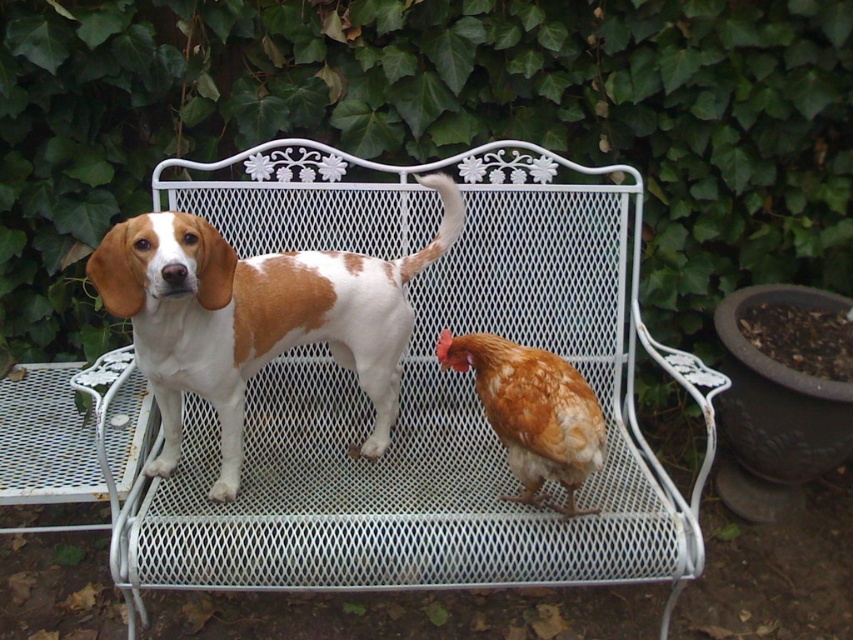
Question: Among these points, which one is farthest from the camera?

Choices:
 (A) (381, 442)
 (B) (556, 452)
 (C) (177, 184)

Answer: (C)

Question: Which point is closer to the camera?

Choices:
 (A) brown and white fur dog at center
 (B) white metal bench at center

Answer: (A)

Question: Which of the following is the closest to the observer?

Choices:
 (A) (405, 410)
 (B) (566, 388)
 (C) (251, 259)

Answer: (B)

Question: Is brown and white fur dog at center above brown feathered chicken at center?

Choices:
 (A) yes
 (B) no

Answer: (A)

Question: Where is brown and white fur dog at center located in relation to brown feathered chicken at center in the image?

Choices:
 (A) left
 (B) right

Answer: (A)

Question: Does brown and white fur dog at center have a lesser width compared to brown feathered chicken at center?

Choices:
 (A) no
 (B) yes

Answer: (A)